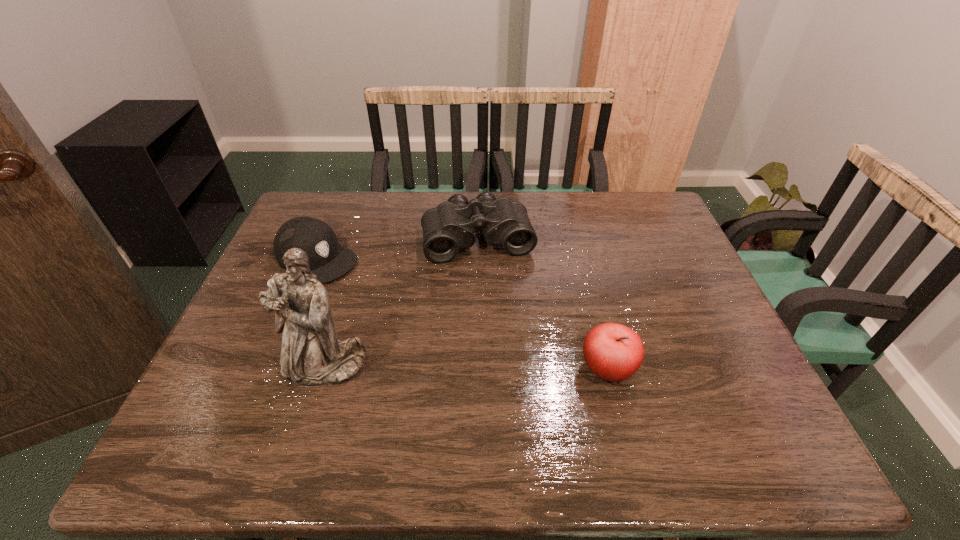
Identify the location of free space between the third object from left to right and the cap. (397, 249).

Where is `free space between the second object from right to left and the apple`? This screenshot has width=960, height=540. free space between the second object from right to left and the apple is located at coordinates (542, 305).

This screenshot has height=540, width=960. What are the coordinates of `vacant space that is in between the apple and the figurine` in the screenshot? It's located at (467, 368).

Identify which object is the closest to the rightmost object. Please provide its 2D coordinates. Your answer should be formatted as a tuple, i.e. [(x, y)], where the tuple contains the x and y coordinates of a point satisfying the conditions above.

[(448, 227)]

Image resolution: width=960 pixels, height=540 pixels. Identify the location of object identified as the closest to the third object from left to right. (328, 260).

Find the location of a particular element. vacant area in the image that satisfies the following two spatial constraints: 1. on the front side of the cap; 2. on the left side of the rightmost object is located at coordinates (271, 370).

The image size is (960, 540). Find the location of `free region that satisfies the following two spatial constraints: 1. on the front side of the third object from left to right; 2. on the right side of the apple`. free region that satisfies the following two spatial constraints: 1. on the front side of the third object from left to right; 2. on the right side of the apple is located at coordinates (477, 370).